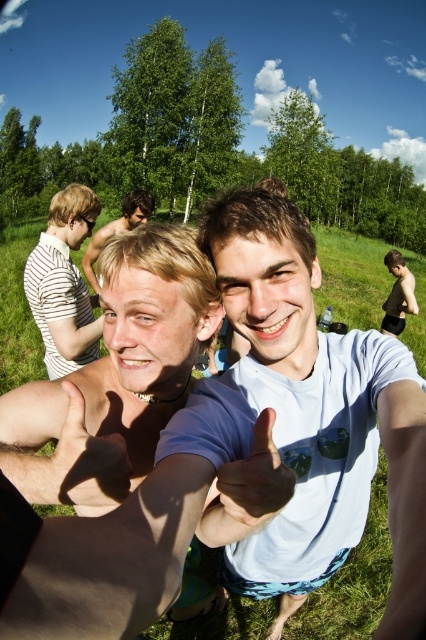
You are a photographer trying to capture both the smooth skin hand at center and the matte skin hand at center in a single frame. Given their size difference, which hand will appear bigger in the photo?

The smooth skin hand at center will appear bigger in the photo because it is larger in size than the matte skin hand at center.

You are a photographer trying to capture a photo of the two young men in the scene. You want to ensure that both the green grass at center and the matte black tank top at center are clearly visible in your shot. Based on their positions, which object is closer to the camera?

The green grass at center is to the left of the matte black tank top at center, so the green grass at center is closer to the camera.